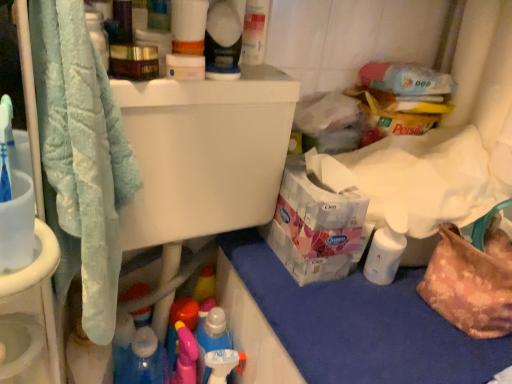
Question: Is white glossy lotion at lower right turned away from matte white spray bottle at upper center?

Choices:
 (A) no
 (B) yes

Answer: (A)

Question: Is white glossy lotion at lower right outside matte white spray bottle at upper center?

Choices:
 (A) yes
 (B) no

Answer: (A)

Question: From a real-world perspective, is white glossy lotion at lower right under matte white spray bottle at upper center?

Choices:
 (A) no
 (B) yes

Answer: (B)

Question: From the image's perspective, is white glossy lotion at lower right on top of matte white spray bottle at upper center?

Choices:
 (A) no
 (B) yes

Answer: (A)

Question: Is white glossy lotion at lower right aimed at matte white spray bottle at upper center?

Choices:
 (A) no
 (B) yes

Answer: (A)

Question: Is matte white spray bottle at upper center taller or shorter than soft blue towel at left?

Choices:
 (A) tall
 (B) short

Answer: (B)

Question: Based on their positions, is matte white spray bottle at upper center located to the left or right of soft blue towel at left?

Choices:
 (A) left
 (B) right

Answer: (B)

Question: From the image's perspective, is matte white spray bottle at upper center above or below soft blue towel at left?

Choices:
 (A) below
 (B) above

Answer: (B)

Question: From a real-world perspective, is matte white spray bottle at upper center above or below soft blue towel at left?

Choices:
 (A) above
 (B) below

Answer: (A)

Question: In terms of width, does white glossy lotion at lower right look wider or thinner when compared to blue fabric at lower right?

Choices:
 (A) wide
 (B) thin

Answer: (B)

Question: Is white glossy lotion at lower right taller or shorter than blue fabric at lower right?

Choices:
 (A) tall
 (B) short

Answer: (A)

Question: From a real-world perspective, is white glossy lotion at lower right above or below blue fabric at lower right?

Choices:
 (A) below
 (B) above

Answer: (B)

Question: In the image, is white glossy lotion at lower right positioned in front of or behind blue fabric at lower right?

Choices:
 (A) front
 (B) behind

Answer: (B)

Question: Do you think soft blue towel at left is within blue fabric at lower right, or outside of it?

Choices:
 (A) inside
 (B) outside

Answer: (B)

Question: Considering the positions of soft blue towel at left and blue fabric at lower right in the image, is soft blue towel at left taller or shorter than blue fabric at lower right?

Choices:
 (A) tall
 (B) short

Answer: (A)